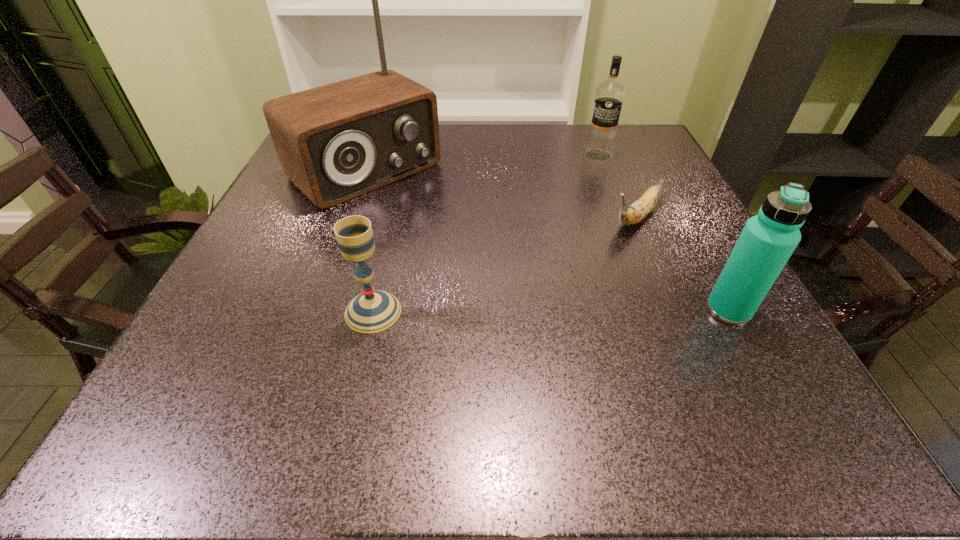
The width and height of the screenshot is (960, 540). Find the location of `water bottle present at the right edge`. water bottle present at the right edge is located at coordinates (767, 241).

At what (x,y) coordinates should I click in order to perform the action: click on vodka situated at the right edge. Please return your answer as a coordinate pair (x, y). The height and width of the screenshot is (540, 960). Looking at the image, I should click on (609, 95).

Image resolution: width=960 pixels, height=540 pixels. Identify the location of banana at the right edge. (629, 215).

The image size is (960, 540). In order to click on object present at the far left corner in this screenshot , I will do `click(335, 142)`.

What are the coordinates of `object located at the far right corner` in the screenshot? It's located at (609, 95).

Locate an element on the screen. vacant space at the far edge is located at coordinates (503, 152).

At what (x,y) coordinates should I click in order to perform the action: click on free space at the near edge. Please return your answer as a coordinate pair (x, y). This screenshot has height=540, width=960. Looking at the image, I should click on (633, 381).

This screenshot has width=960, height=540. I want to click on vacant region at the left edge of the desktop, so click(x=278, y=213).

At what (x,y) coordinates should I click in order to perform the action: click on vacant space at the right edge. Please return your answer as a coordinate pair (x, y). This screenshot has height=540, width=960. Looking at the image, I should click on (709, 263).

Locate an element on the screen. This screenshot has width=960, height=540. vacant space at the near left corner of the desktop is located at coordinates (271, 368).